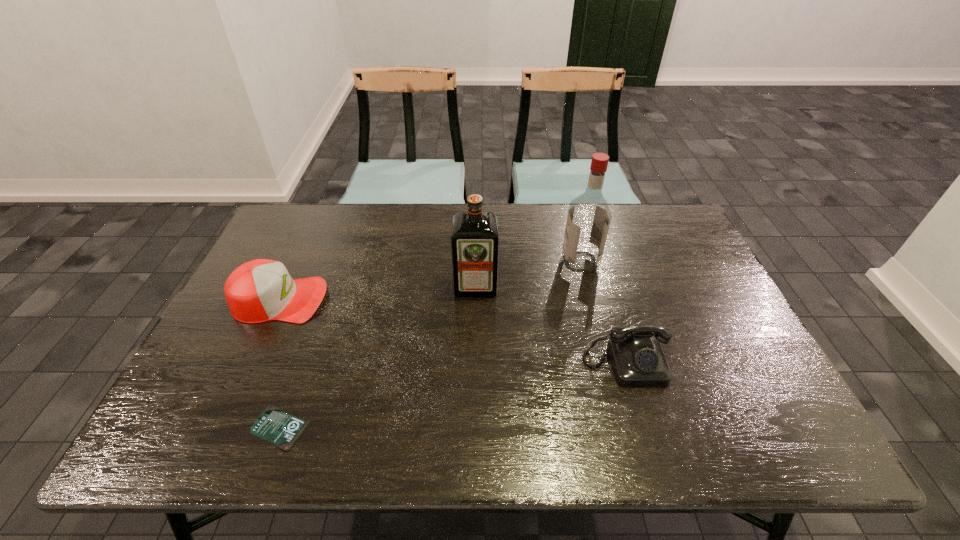
The image size is (960, 540). Identify the location of empty location between the fourth tallest object and the identity card. (452, 395).

Where is `free space between the tallest object and the shortest object`? The height and width of the screenshot is (540, 960). free space between the tallest object and the shortest object is located at coordinates (430, 345).

Locate an element on the screen. free point between the fourth tallest object and the baseball cap is located at coordinates (453, 332).

Identify the location of object that is the third closest to the shortest object. (637, 357).

Locate an element on the screen. The width and height of the screenshot is (960, 540). object that is the fourth closest to the shortest object is located at coordinates (589, 216).

I want to click on free location that satisfies the following two spatial constraints: 1. on the front-facing side of the shortest object; 2. on the right side of the baseball cap, so click(222, 427).

Where is `vacant point that satisfies the following two spatial constraints: 1. on the front label of the third object from left to right; 2. on the front-facing side of the baseball cap`? vacant point that satisfies the following two spatial constraints: 1. on the front label of the third object from left to right; 2. on the front-facing side of the baseball cap is located at coordinates click(475, 300).